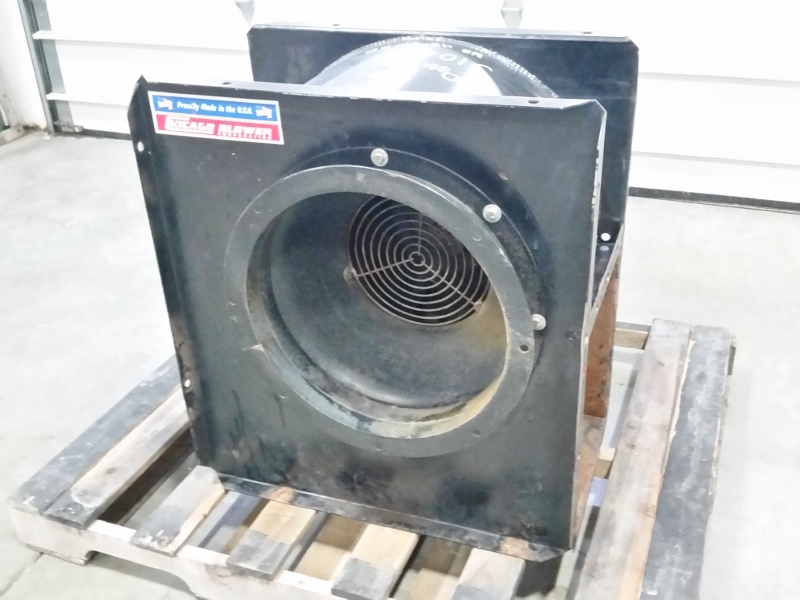
The width and height of the screenshot is (800, 600). Identify the location of vent. (382, 261).